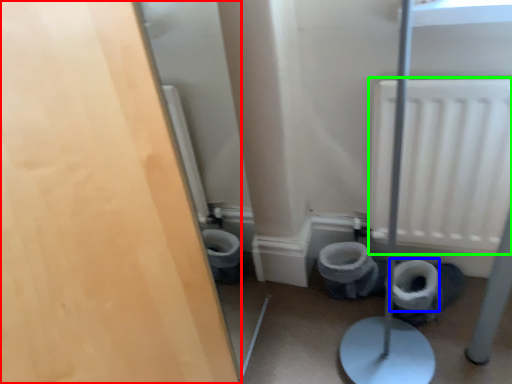
Question: Which object is the closest to the door (highlighted by a red box)? Choose among these: toilet paper (highlighted by a blue box) or radiator (highlighted by a green box).

Choices:
 (A) toilet paper
 (B) radiator

Answer: (B)